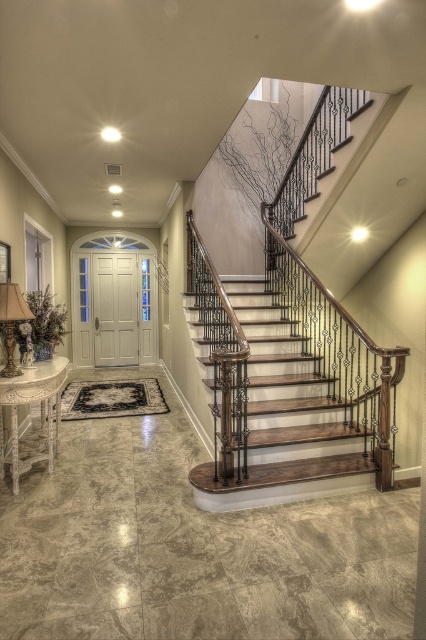
Which is below, wooden stairs at center or matte gold lamp at lower left?

wooden stairs at center

The width and height of the screenshot is (426, 640). What are the coordinates of `wooden stairs at center` in the screenshot? It's located at (284, 404).

Locate an element on the screen. wooden stairs at center is located at coordinates (284, 404).